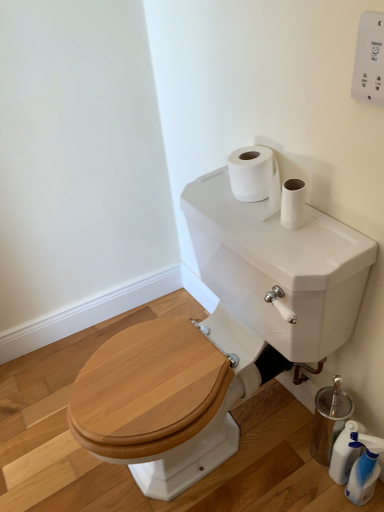
I want to click on free space to the left of translucent plastic bottle at lower right, which ranks as the 2th cleaning product in front-to-back order, so click(x=283, y=474).